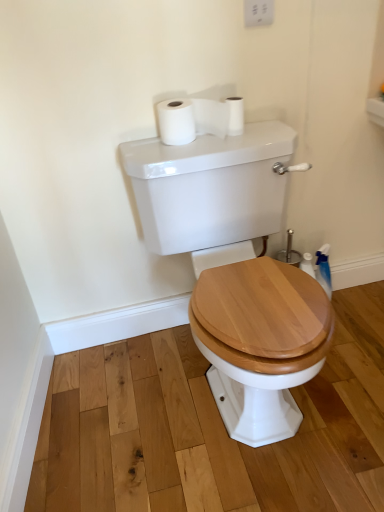
At what (x,y) coordinates should I click in order to perform the action: click on vacant space in white glossy porcelain at center (from a real-world perspective). Please return your answer as a coordinate pair (x, y). The height and width of the screenshot is (512, 384). Looking at the image, I should click on (229, 415).